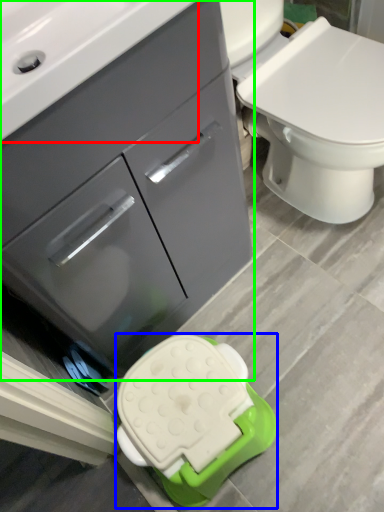
Question: Which object is positioned farthest from sink (highlighted by a red box)? Select from porcelain (highlighted by a blue box) and bathroom cabinet (highlighted by a green box).

Choices:
 (A) porcelain
 (B) bathroom cabinet

Answer: (A)